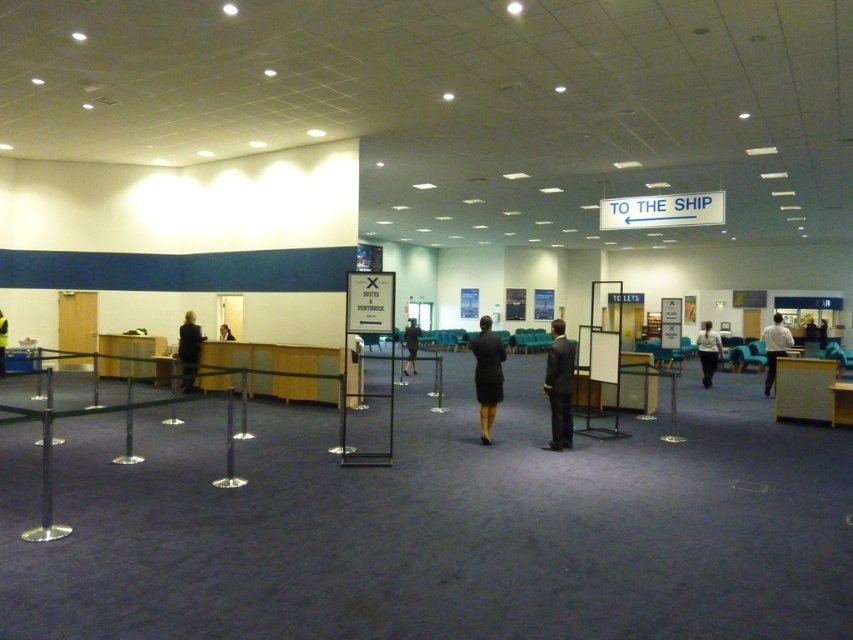
You are standing in the cruise terminal and want to move from point A to point B. Point A is at coordinates point (473, 346) and point B is at coordinates point (413, 333). Which point is closer to you if you are facing the direction of the cruise terminal entrance?

Point (473, 346) is closer to the viewer than point (413, 333), so point A is closer to you.

You are a passenger in a hurry and need to reach the black suit at center to ask for help. The wooden desk at left is blocking your path. Can you walk around it without crossing into restricted areas?

The wooden desk at left is 5.58 feet away from the black suit at center. Since the desk is blocking your path but the distance between them allows for maneuvering around it, you can walk around the desk to reach the black suit at center without crossing restricted areas.

You are a photographer standing in the cruise terminal and see the matte black dress at center and the black fabric coat at center. Which one is more to the right?

The matte black dress at center is positioned on the right side of black fabric coat at center, so it is more to the right.